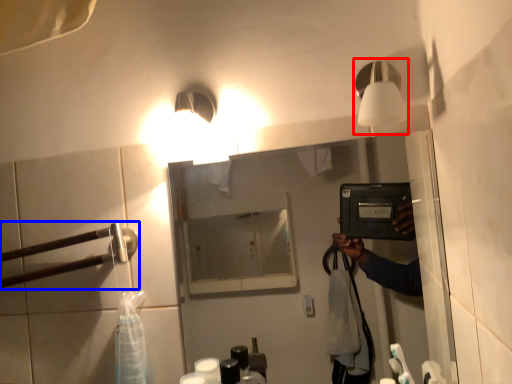
Question: Which object is further to the camera taking this photo, light fixture (highlighted by a red box) or door handle (highlighted by a blue box)?

Choices:
 (A) light fixture
 (B) door handle

Answer: (B)